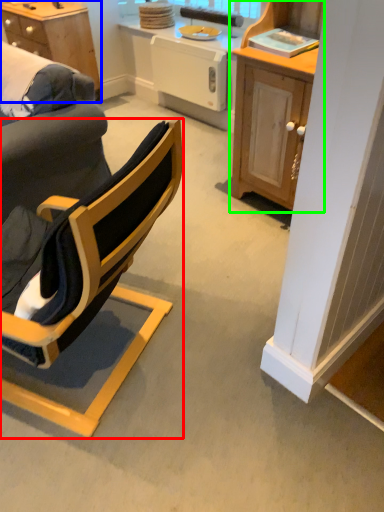
Question: Which object is the farthest from chair (highlighted by a red box)? Choose among these: desk (highlighted by a blue box) or cabinetry (highlighted by a green box).

Choices:
 (A) desk
 (B) cabinetry

Answer: (A)